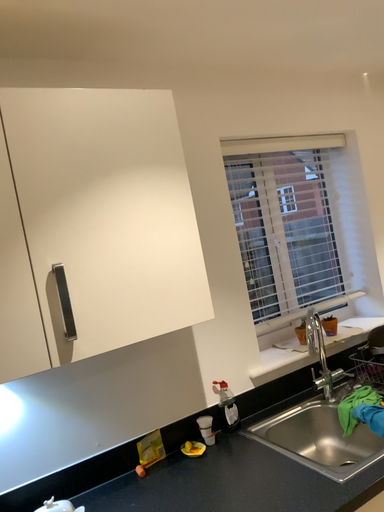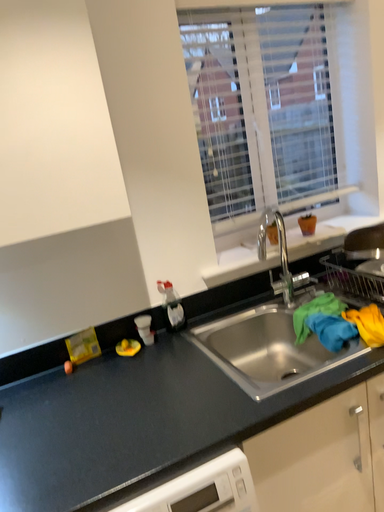
Question: Which way did the camera rotate in the video?

Choices:
 (A) rotated downward
 (B) rotated upward

Answer: (A)